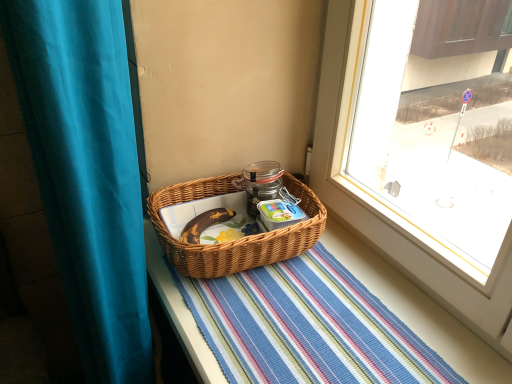
Find the location of a particular element. The width and height of the screenshot is (512, 384). striped woven mat at center is located at coordinates (307, 327).

Is striped woven mat at center at the left side of teal fabric curtain at left?

No.

Consider the image. Considering the relative sizes of striped woven mat at center and teal fabric curtain at left in the image provided, is striped woven mat at center shorter than teal fabric curtain at left?

Correct, striped woven mat at center is not as tall as teal fabric curtain at left.

Based on the photo, is striped woven mat at center positioned beyond the bounds of teal fabric curtain at left?

That's correct, striped woven mat at center is outside of teal fabric curtain at left.

Who is bigger, striped woven mat at center or teal fabric curtain at left?

With larger size is teal fabric curtain at left.

From a real-world perspective, who is located lower, woven brown picnic basket at center or teal fabric curtain at left?

From a 3D spatial view, teal fabric curtain at left is below.

Is woven brown picnic basket at center at the right side of teal fabric curtain at left?

Yes.

How different are the orientations of woven brown picnic basket at center and teal fabric curtain at left in degrees?

The angular difference between woven brown picnic basket at center and teal fabric curtain at left is 0.0812 degrees.

Considering the sizes of objects woven brown picnic basket at center and teal fabric curtain at left in the image provided, who is thinner, woven brown picnic basket at center or teal fabric curtain at left?

teal fabric curtain at left is thinner.

Is striped woven mat at center wider or thinner than woven brown picnic basket at center?

In the image, striped woven mat at center appears to be wider than woven brown picnic basket at center.

Is striped woven mat at center facing towards woven brown picnic basket at center?

No.

From the image's perspective, which one is positioned higher, striped woven mat at center or woven brown picnic basket at center?

woven brown picnic basket at center.

Considering the points (60, 29) and (280, 308), which point is in front, point (60, 29) or point (280, 308)?

The point (60, 29) is more forward.

From the image's perspective, relative to striped woven mat at center, is teal fabric curtain at left above or below?

Based on their image positions, teal fabric curtain at left is located beneath striped woven mat at center.

From a real-world perspective, is teal fabric curtain at left positioned under striped woven mat at center based on gravity?

Yes, from a real-world perspective, teal fabric curtain at left is below striped woven mat at center.

Is striped woven mat at center surrounded by woven brown picnic basket at center?

No, striped woven mat at center is located outside of woven brown picnic basket at center.

Considering the positions of objects woven brown picnic basket at center and striped woven mat at center in the image provided, who is more to the left, woven brown picnic basket at center or striped woven mat at center?

From the viewer's perspective, woven brown picnic basket at center appears more on the left side.

Is woven brown picnic basket at center with striped woven mat at center?

No, woven brown picnic basket at center is not making contact with striped woven mat at center.

Which is behind, point (303, 249) or point (380, 312)?

Positioned behind is point (303, 249).

How many degrees apart are the facing directions of teal fabric curtain at left and woven brown picnic basket at center?

The angular difference between teal fabric curtain at left and woven brown picnic basket at center is 0.0812 degrees.

From a real-world perspective, is teal fabric curtain at left physically located above or below woven brown picnic basket at center?

teal fabric curtain at left is below woven brown picnic basket at center.

Considering the sizes of objects teal fabric curtain at left and woven brown picnic basket at center in the image provided, who is wider, teal fabric curtain at left or woven brown picnic basket at center?

Wider between the two is woven brown picnic basket at center.

You are a GUI agent. You are given a task and a screenshot of the screen. Output one action in this format:
    pyautogui.click(x=<x>, y=<y>)
    Task: Click on the mat above the teal fabric curtain at left (from the image's perspective)
    
    Given the screenshot: What is the action you would take?
    pyautogui.click(x=307, y=327)

This screenshot has height=384, width=512. Find the location of `picnic basket on the right of the teal fabric curtain at left`. picnic basket on the right of the teal fabric curtain at left is located at coordinates (234, 240).

Estimate the real-world distances between objects in this image. Which object is further from teal fabric curtain at left, striped woven mat at center or woven brown picnic basket at center?

Based on the image, striped woven mat at center appears to be further to teal fabric curtain at left.

Which object lies further to the anchor point teal fabric curtain at left, woven brown picnic basket at center or striped woven mat at center?

striped woven mat at center is positioned further to the anchor teal fabric curtain at left.

From the image, which object appears to be nearer to woven brown picnic basket at center, teal fabric curtain at left or striped woven mat at center?

striped woven mat at center is closer to woven brown picnic basket at center.

Which object lies nearer to the anchor point striped woven mat at center, teal fabric curtain at left or woven brown picnic basket at center?

woven brown picnic basket at center lies closer to striped woven mat at center than the other object.

Looking at the image, which one is located further to woven brown picnic basket at center, striped woven mat at center or teal fabric curtain at left?

teal fabric curtain at left.

Looking at the image, which one is located further to striped woven mat at center, woven brown picnic basket at center or teal fabric curtain at left?

teal fabric curtain at left lies further to striped woven mat at center than the other object.

At what (x,y) coordinates should I click in order to perform the action: click on picnic basket located between teal fabric curtain at left and striped woven mat at center in the left-right direction. Please return your answer as a coordinate pair (x, y). Looking at the image, I should click on (234, 240).